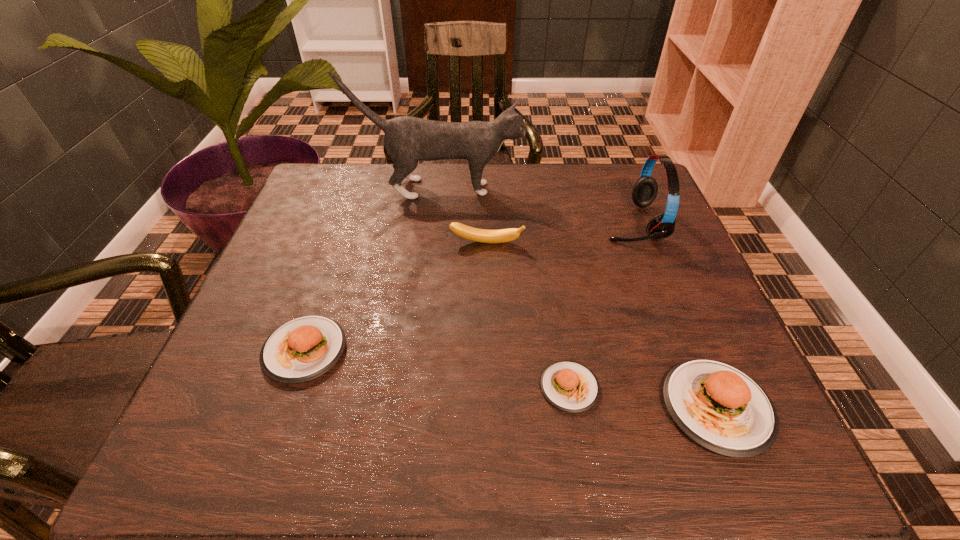
Locate an element on the screen. blank space that satisfies the following two spatial constraints: 1. at the face of the cat; 2. on the left side of the shortest object is located at coordinates (415, 387).